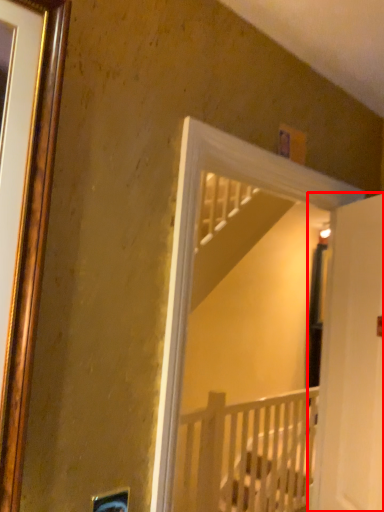
Question: From the image's perspective, considering the relative positions of door (annotated by the red box) and infant bed in the image provided, where is door (annotated by the red box) located with respect to the staircase?

Choices:
 (A) below
 (B) above

Answer: (B)